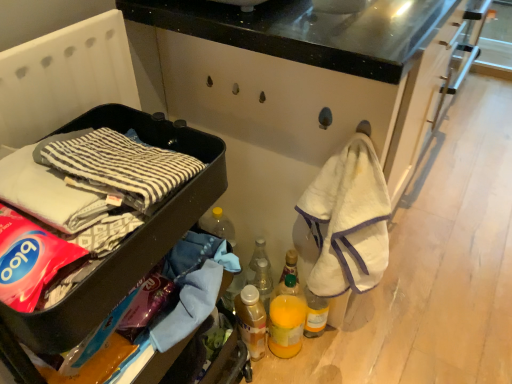
Question: Considering the relative sizes of translucent plastic bottle at center, arranged as the 1th bottle when viewed from the top, and translucent plastic bottle at lower center, the second bottle positioned from the top, in the image provided, is translucent plastic bottle at center, arranged as the 1th bottle when viewed from the top, taller than translucent plastic bottle at lower center, the second bottle positioned from the top,?

Choices:
 (A) yes
 (B) no

Answer: (B)

Question: Is translucent plastic bottle at center, the second bottle ordered from the bottom, at the right side of translucent plastic bottle at lower center, the second bottle positioned from the top?

Choices:
 (A) yes
 (B) no

Answer: (A)

Question: From a real-world perspective, is translucent plastic bottle at center, the second bottle ordered from the bottom, over translucent plastic bottle at lower center, the second bottle positioned from the top?

Choices:
 (A) no
 (B) yes

Answer: (B)

Question: From the image's perspective, does translucent plastic bottle at center, arranged as the 1th bottle when viewed from the top, appear lower than translucent plastic bottle at lower center, the first bottle ordered from the bottom?

Choices:
 (A) no
 (B) yes

Answer: (A)

Question: Can you confirm if translucent plastic bottle at center, the second bottle ordered from the bottom, is thinner than translucent plastic bottle at lower center, the first bottle ordered from the bottom?

Choices:
 (A) no
 (B) yes

Answer: (B)

Question: Considering their positions, is black plastic container at left located in front of or behind translucent plastic bottle at center, arranged as the 1th bottle when viewed from the top?

Choices:
 (A) behind
 (B) front

Answer: (B)

Question: From their relative heights in the image, would you say black plastic container at left is taller or shorter than translucent plastic bottle at center, the second bottle ordered from the bottom?

Choices:
 (A) tall
 (B) short

Answer: (A)

Question: In terms of size, does black plastic container at left appear bigger or smaller than translucent plastic bottle at center, arranged as the 1th bottle when viewed from the top?

Choices:
 (A) big
 (B) small

Answer: (A)

Question: Looking at their shapes, would you say black plastic container at left is wider or thinner than translucent plastic bottle at center, the second bottle ordered from the bottom?

Choices:
 (A) thin
 (B) wide

Answer: (B)

Question: From a real-world perspective, is translucent plastic bottle at center, arranged as the 1th bottle when viewed from the top, positioned above or below black plastic container at left?

Choices:
 (A) below
 (B) above

Answer: (A)

Question: Is translucent plastic bottle at center, arranged as the 1th bottle when viewed from the top, wider or thinner than black plastic container at left?

Choices:
 (A) thin
 (B) wide

Answer: (A)

Question: Would you say translucent plastic bottle at center, the second bottle ordered from the bottom, is to the left or to the right of black plastic container at left in the picture?

Choices:
 (A) right
 (B) left

Answer: (A)

Question: Which is correct: translucent plastic bottle at center, the second bottle ordered from the bottom, is inside black plastic container at left, or outside of it?

Choices:
 (A) outside
 (B) inside

Answer: (A)

Question: Does point (254, 306) appear closer or farther from the camera than point (162, 125)?

Choices:
 (A) closer
 (B) farther

Answer: (B)

Question: From a real-world perspective, is translucent plastic bottle at lower center, the second bottle positioned from the top, positioned above or below black plastic container at left?

Choices:
 (A) above
 (B) below

Answer: (B)